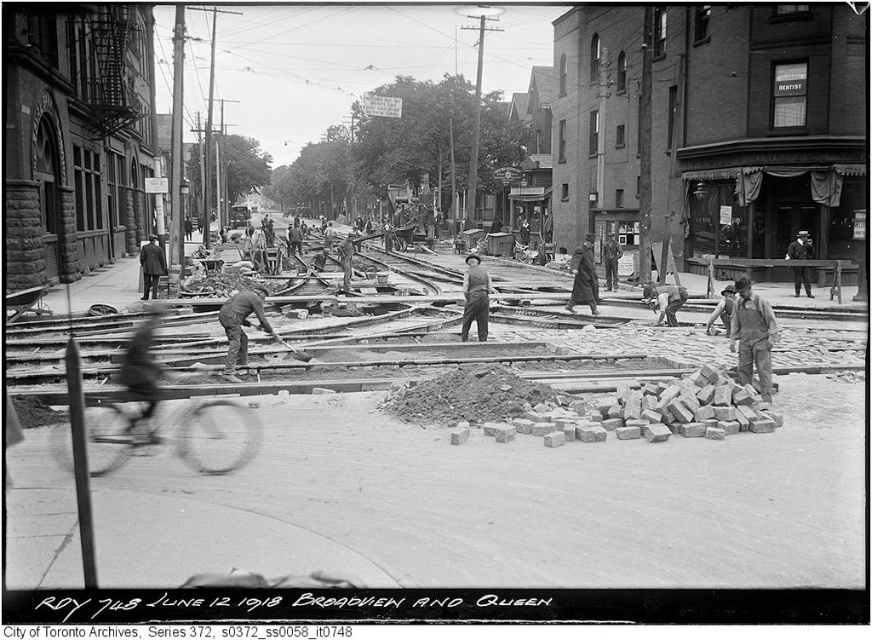
You are a construction worker at the site and need to choose a tool to carry bricks. Which object between the rustic wooden shovel at center and the dark brown suit at left is narrower so it can fit through tight spaces?

The rustic wooden shovel at center is narrower than the dark brown suit at left, so it would be better to choose the rustic wooden shovel at center to fit through tight spaces.

You are a historian examining this historical photo from 1918. You notice the rustic wooden shovel at center and the dark brown suit at left. Which object takes up more area in the image?

The dark brown suit at left occupies more space than the rustic wooden shovel at center.